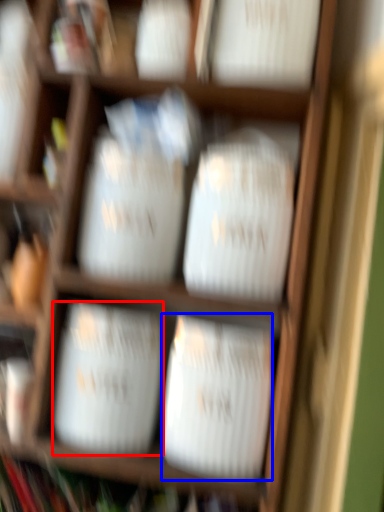
Question: Which point is further to the camera, wide (highlighted by a red box) or wide (highlighted by a blue box)?

Choices:
 (A) wide
 (B) wide

Answer: (A)